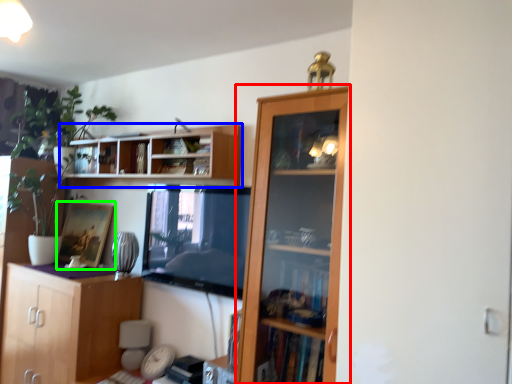
Question: Estimate the real-world distances between objects in this image. Which object is farther from cupboard (highlighted by a red box), shelf (highlighted by a blue box) or picture frame (highlighted by a green box)?

Choices:
 (A) shelf
 (B) picture frame

Answer: (B)